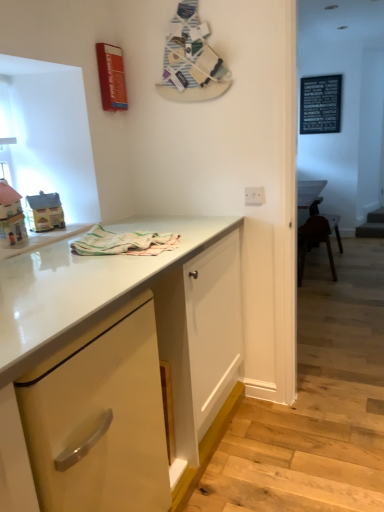
Question: Is pastel striped cloth at center taller or shorter than matte yellow house at left, the first toy from the back?

Choices:
 (A) tall
 (B) short

Answer: (B)

Question: Is point (157, 243) closer or farther from the camera than point (29, 202)?

Choices:
 (A) farther
 (B) closer

Answer: (B)

Question: Estimate the real-world distances between objects in this image. Which object is farther from the matte yellow house at left, the first toy from the back?

Choices:
 (A) matte yellow cabinet at center, which is the first cabinetry from front to back
 (B) black matte bulletin board at upper right
 (C) pastel striped cloth at center
 (D) white glossy electric outlet at upper center
 (E) matte yellow cabinet at lower left, the 2th cabinetry in the front-to-back sequence

Answer: (B)

Question: Based on their relative distances, which object is nearer to the matte yellow cabinet at lower left, marked as the 1th cabinetry in a back-to-front arrangement?

Choices:
 (A) white glossy electric outlet at upper center
 (B) black matte bulletin board at upper right
 (C) matte yellow cabinet at center, which is the first cabinetry from front to back
 (D) pastel striped cloth at center
 (E) matte yellow house at left, the 2th toy positioned from the front

Answer: (C)